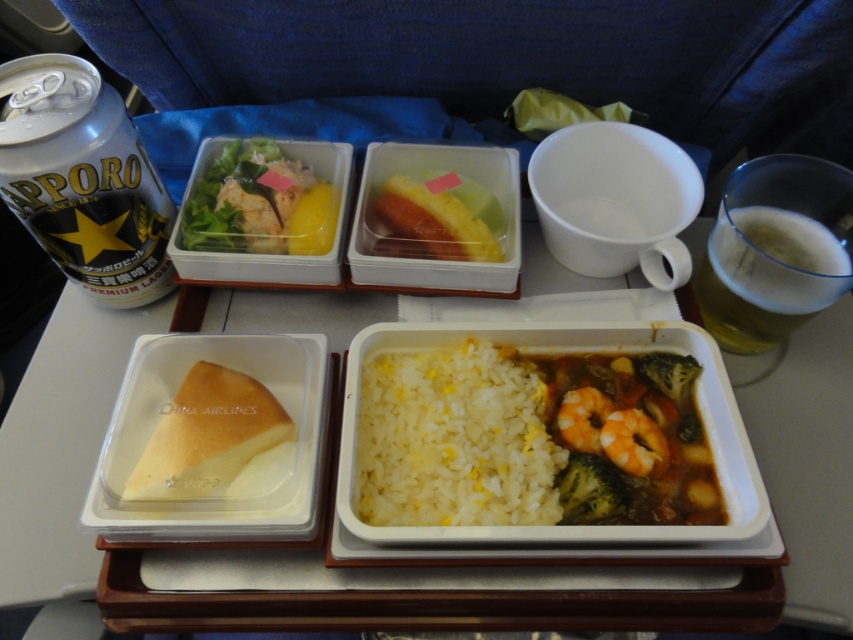
Question: Is translucent plastic cheese at center bigger than golden amber liquid at upper right?

Choices:
 (A) no
 (B) yes

Answer: (A)

Question: Which point appears farthest from the camera in this image?

Choices:
 (A) pyautogui.click(x=480, y=211)
 (B) pyautogui.click(x=611, y=472)
 (C) pyautogui.click(x=4, y=161)
 (D) pyautogui.click(x=386, y=410)

Answer: (A)

Question: Which of these objects is positioned closest to the yellow matte pineapple at center?

Choices:
 (A) white matte rice at center
 (B) green matte broccoli at center

Answer: (A)

Question: Which object is the farthest from the green matte salad at upper left?

Choices:
 (A) white matte rice at center
 (B) yellow matte pineapple at center
 (C) shiny brown shrimp at center

Answer: (C)

Question: Is white matte rice at center wider than shiny brown shrimp at center?

Choices:
 (A) yes
 (B) no

Answer: (A)

Question: Does silver metallic can at upper left appear on the right side of green matte broccoli at center?

Choices:
 (A) no
 (B) yes

Answer: (A)